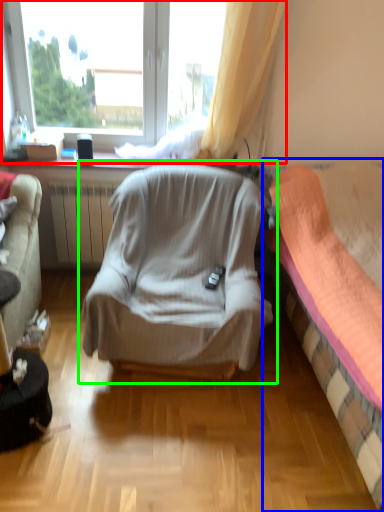
Question: Estimate the real-world distances between objects in this image. Which object is farther from window (highlighted by a red box), bed (highlighted by a blue box) or chair (highlighted by a green box)?

Choices:
 (A) bed
 (B) chair

Answer: (A)